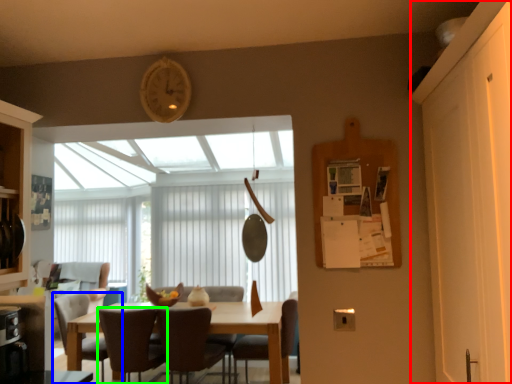
Question: Estimate the real-world distances between objects in this image. Which object is farther from screen door (highlighted by a red box), chair (highlighted by a blue box) or chair (highlighted by a green box)?

Choices:
 (A) chair
 (B) chair

Answer: (A)